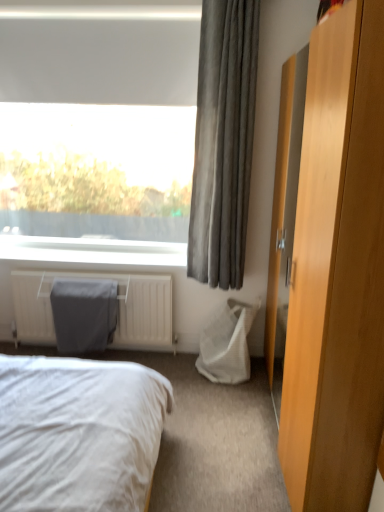
Describe the element at coordinates (78, 433) in the screenshot. I see `white fabric bed at lower left` at that location.

What do you see at coordinates (84, 314) in the screenshot? Image resolution: width=384 pixels, height=512 pixels. I see `matte fabric radiator cover at lower left` at bounding box center [84, 314].

The image size is (384, 512). Identify the location of light brown wood dresser at right. (337, 272).

From a real-world perspective, which object rests below the other?

light brown wood dresser at right.

Can you confirm if light brown wood dresser at right is bigger than gray fabric curtain at upper right?

Yes, light brown wood dresser at right is bigger than gray fabric curtain at upper right.

Choose the correct answer: Is light brown wood dresser at right inside gray fabric curtain at upper right or outside it?

light brown wood dresser at right is outside gray fabric curtain at upper right.

Between light brown wood dresser at right and gray fabric curtain at upper right, which one appears on the left side from the viewer's perspective?

From the viewer's perspective, gray fabric curtain at upper right appears more on the left side.

From a real-world perspective, is white fabric bed at lower left under gray fabric curtain at upper right?

Correct, in the physical world, white fabric bed at lower left is lower than gray fabric curtain at upper right.

Can you tell me how much white fabric bed at lower left and gray fabric curtain at upper right differ in facing direction?

There is a 90.8-degree angle between the facing directions of white fabric bed at lower left and gray fabric curtain at upper right.

Is white fabric bed at lower left wider or thinner than gray fabric curtain at upper right?

Considering their sizes, white fabric bed at lower left looks broader than gray fabric curtain at upper right.

Which object is further away from the camera, white fabric bed at lower left or gray fabric curtain at upper right?

gray fabric curtain at upper right is further from the camera.

Is light brown wood dresser at right touching white fabric bed at lower left?

No, light brown wood dresser at right is not next to white fabric bed at lower left.

Is light brown wood dresser at right wider than white fabric bed at lower left?

Incorrect, the width of light brown wood dresser at right does not surpass that of white fabric bed at lower left.

Can you tell me how much light brown wood dresser at right and white fabric bed at lower left differ in facing direction?

light brown wood dresser at right and white fabric bed at lower left are facing 179 degrees away from each other.

Measure the distance from light brown wood dresser at right to white fabric bed at lower left.

light brown wood dresser at right and white fabric bed at lower left are 36.50 inches apart from each other.

Consider the image. Considering the sizes of objects gray fabric curtain at upper right and white fabric bed at lower left in the image provided, who is thinner, gray fabric curtain at upper right or white fabric bed at lower left?

gray fabric curtain at upper right is thinner.

Are gray fabric curtain at upper right and white fabric bed at lower left making contact?

No.

From the image's perspective, relative to white fabric bed at lower left, is gray fabric curtain at upper right above or below?

gray fabric curtain at upper right is above white fabric bed at lower left.

Visually, is light brown wood dresser at right positioned to the left or to the right of matte fabric radiator cover at lower left?

In the image, light brown wood dresser at right appears on the right side of matte fabric radiator cover at lower left.

From the image's perspective, between light brown wood dresser at right and matte fabric radiator cover at lower left, which one is located above?

light brown wood dresser at right, from the image's perspective.

Are light brown wood dresser at right and matte fabric radiator cover at lower left making contact?

No, light brown wood dresser at right is not in contact with matte fabric radiator cover at lower left.

Which point is more forward, (381, 433) or (93, 346)?

The point (381, 433) is closer.

Find the location of a particular element. This screenshot has height=512, width=384. gray lying below the gray fabric curtain at upper right (from the image's perspective) is located at coordinates (84, 314).

Does point (72, 303) appear closer or farther from the camera than point (196, 177)?

Point (72, 303).

Is matte fabric radiator cover at lower left facing away from gray fabric curtain at upper right?

No, matte fabric radiator cover at lower left is not facing away from gray fabric curtain at upper right.

Who is smaller, matte fabric radiator cover at lower left or white fabric bed at lower left?

With smaller size is matte fabric radiator cover at lower left.

Considering the sizes of matte fabric radiator cover at lower left and white fabric bed at lower left in the image, is matte fabric radiator cover at lower left wider or thinner than white fabric bed at lower left?

Considering their sizes, matte fabric radiator cover at lower left looks slimmer than white fabric bed at lower left.

Is matte fabric radiator cover at lower left not near white fabric bed at lower left?

That's right, there is a large distance between matte fabric radiator cover at lower left and white fabric bed at lower left.

Image resolution: width=384 pixels, height=512 pixels. What are the coordinates of `dresser lying on the right of gray fabric curtain at upper right` in the screenshot? It's located at (337, 272).

Image resolution: width=384 pixels, height=512 pixels. What are the coordinates of `bed in front of the gray fabric curtain at upper right` in the screenshot? It's located at (78, 433).

Based on their spatial positions, is gray fabric curtain at upper right or white fabric bed at lower left closer to matte fabric radiator cover at lower left?

gray fabric curtain at upper right.

From the image, which object appears to be farther from matte fabric radiator cover at lower left, white fabric bed at lower left or gray fabric curtain at upper right?

white fabric bed at lower left lies further to matte fabric radiator cover at lower left than the other object.

Based on their spatial positions, is gray fabric curtain at upper right or matte fabric radiator cover at lower left closer to white fabric bed at lower left?

The object closer to white fabric bed at lower left is matte fabric radiator cover at lower left.

From the image, which object appears to be farther from light brown wood dresser at right, white fabric bed at lower left or matte fabric radiator cover at lower left?

The object further to light brown wood dresser at right is matte fabric radiator cover at lower left.

From the image, which object appears to be nearer to matte fabric radiator cover at lower left, light brown wood dresser at right or white fabric bed at lower left?

The object closer to matte fabric radiator cover at lower left is white fabric bed at lower left.

Looking at this image, which object lies nearer to the anchor point matte fabric radiator cover at lower left, gray fabric curtain at upper right or light brown wood dresser at right?

gray fabric curtain at upper right.

Which object lies nearer to the anchor point gray fabric curtain at upper right, white fabric bed at lower left or light brown wood dresser at right?

light brown wood dresser at right is positioned closer to the anchor gray fabric curtain at upper right.

From the image, which object appears to be nearer to white fabric bed at lower left, matte fabric radiator cover at lower left or gray fabric curtain at upper right?

Based on the image, matte fabric radiator cover at lower left appears to be nearer to white fabric bed at lower left.

This screenshot has width=384, height=512. What are the coordinates of `curtain positioned between light brown wood dresser at right and matte fabric radiator cover at lower left from near to far` in the screenshot? It's located at (223, 142).

At what (x,y) coordinates should I click in order to perform the action: click on curtain located between white fabric bed at lower left and matte fabric radiator cover at lower left in the depth direction. Please return your answer as a coordinate pair (x, y). Looking at the image, I should click on (223, 142).

Identify the location of dresser between white fabric bed at lower left and matte fabric radiator cover at lower left in the front-back direction. (337, 272).

At what (x,y) coordinates should I click in order to perform the action: click on dresser between white fabric bed at lower left and gray fabric curtain at upper right along the z-axis. Please return your answer as a coordinate pair (x, y). The height and width of the screenshot is (512, 384). Looking at the image, I should click on (337, 272).